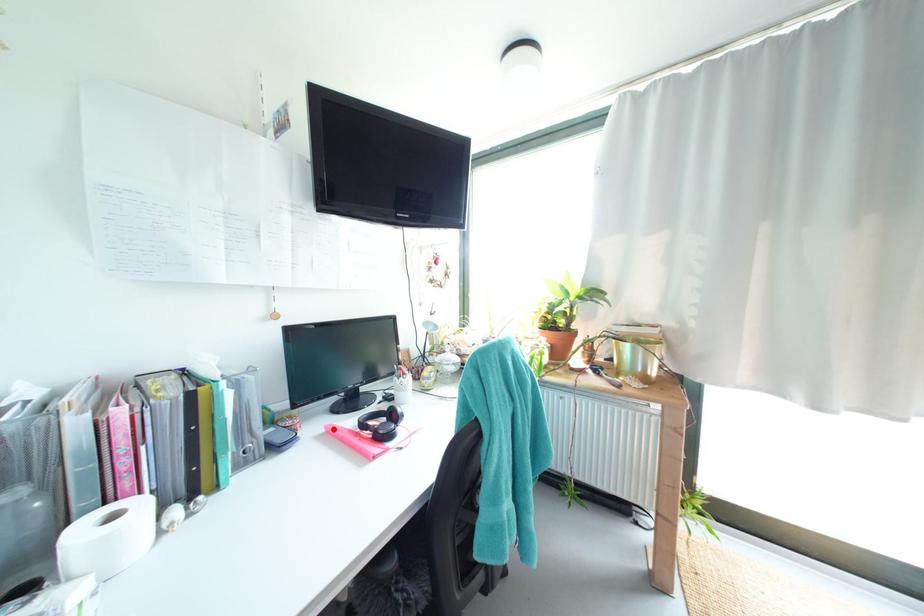
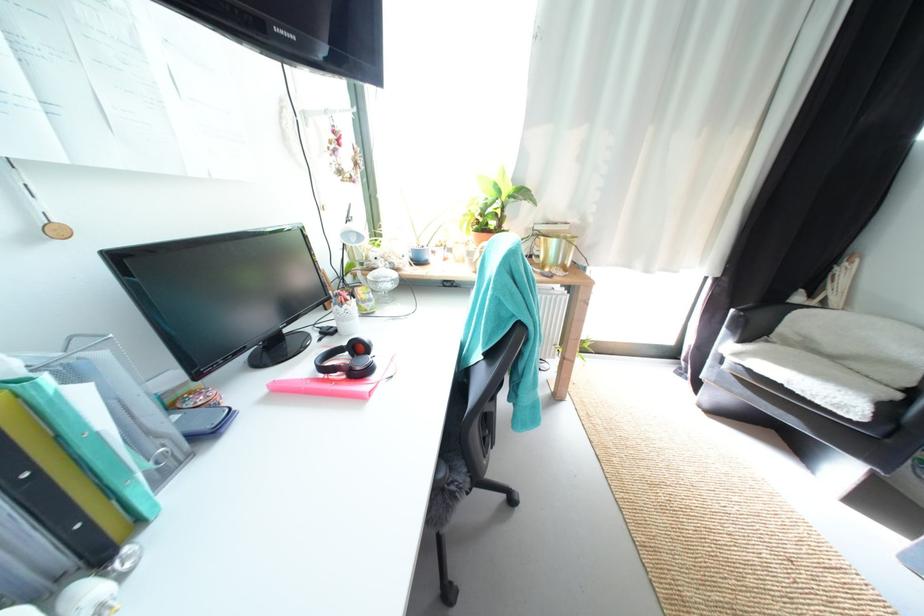
Question: I am providing you with two images of the same scene from different viewpoints. A red point is marked on the first image. At the location where the point appears in image 1, is it still visible in image 2?

Choices:
 (A) Yes
 (B) No

Answer: (A)